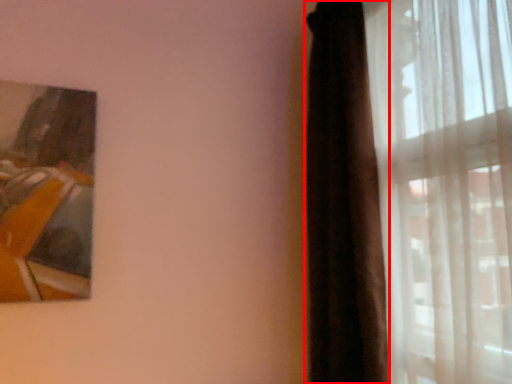
Question: Observing the image, what is the correct spatial positioning of curtain (annotated by the red box) in reference to curtain?

Choices:
 (A) left
 (B) right

Answer: (A)